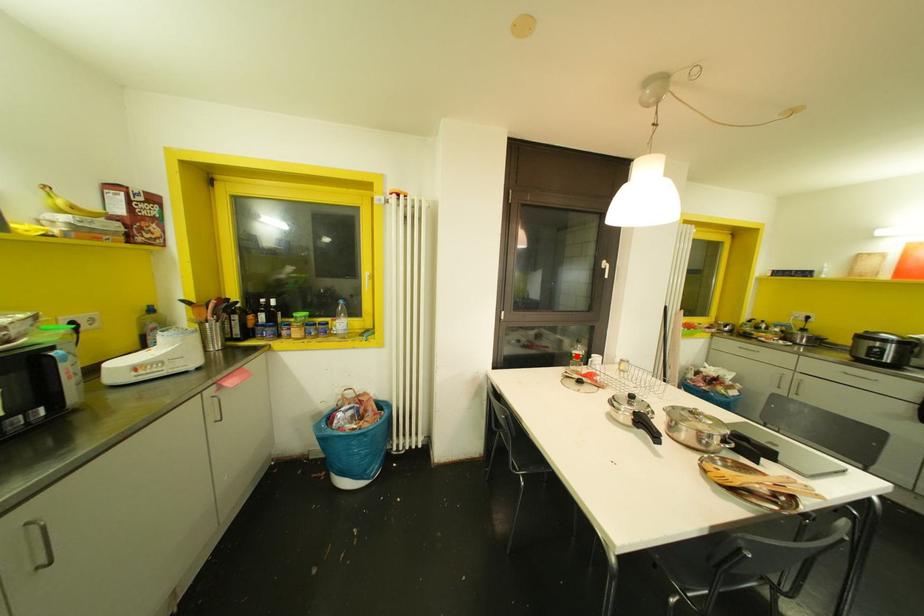
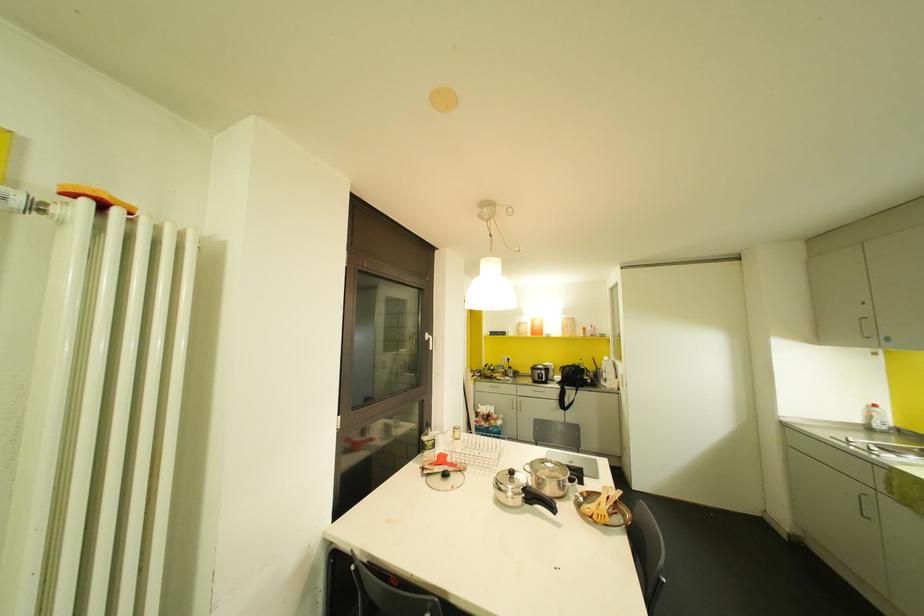
In the second image, find the point that corresponds to the highlighted location in the first image.

(429, 444)